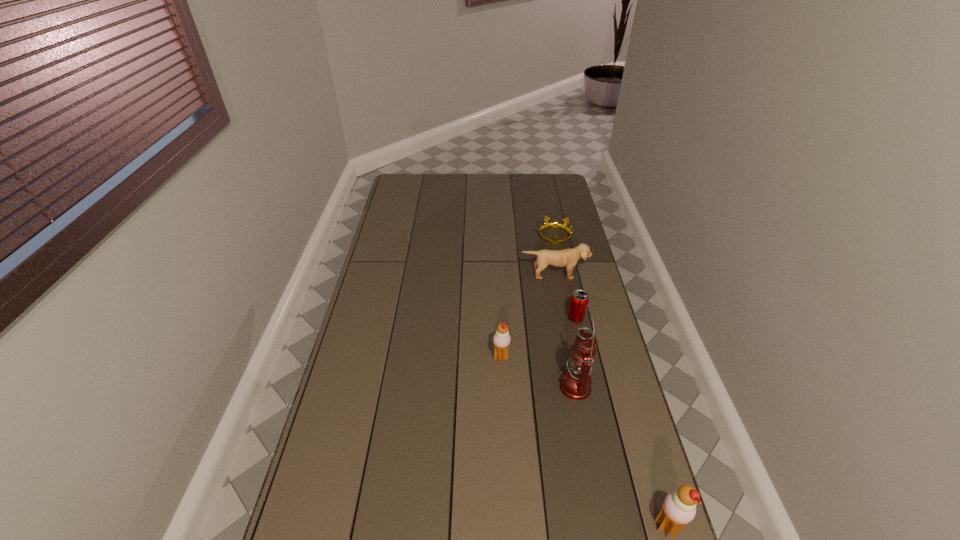
Where is `the farther icecream`? the farther icecream is located at coordinates (501, 340).

At what (x,y) coordinates should I click in order to perform the action: click on the leftmost object. Please return your answer as a coordinate pair (x, y). The image size is (960, 540). Looking at the image, I should click on (501, 340).

Locate an element on the screen. This screenshot has width=960, height=540. the shortest object is located at coordinates (555, 224).

Identify the location of crown. The image size is (960, 540). (555, 224).

Identify the location of the fourth tallest object. This screenshot has height=540, width=960. 568,258.

You are a GUI agent. You are given a task and a screenshot of the screen. Output one action in this format:
    pyautogui.click(x=<x>, y=<y>)
    Task: Click on the fifth nearest object
    The width and height of the screenshot is (960, 540).
    Given the screenshot: What is the action you would take?
    pyautogui.click(x=568, y=258)

Where is `the tallest object`? This screenshot has height=540, width=960. the tallest object is located at coordinates (575, 384).

Locate an element on the screen. the fifth farthest object is located at coordinates (575, 384).

This screenshot has height=540, width=960. I want to click on the second shortest object, so click(x=579, y=301).

You are a GUI agent. You are given a task and a screenshot of the screen. Output one action in this format:
    pyautogui.click(x=<x>, y=<y>)
    Task: Click on the fourth nearest object
    
    Given the screenshot: What is the action you would take?
    pyautogui.click(x=579, y=301)